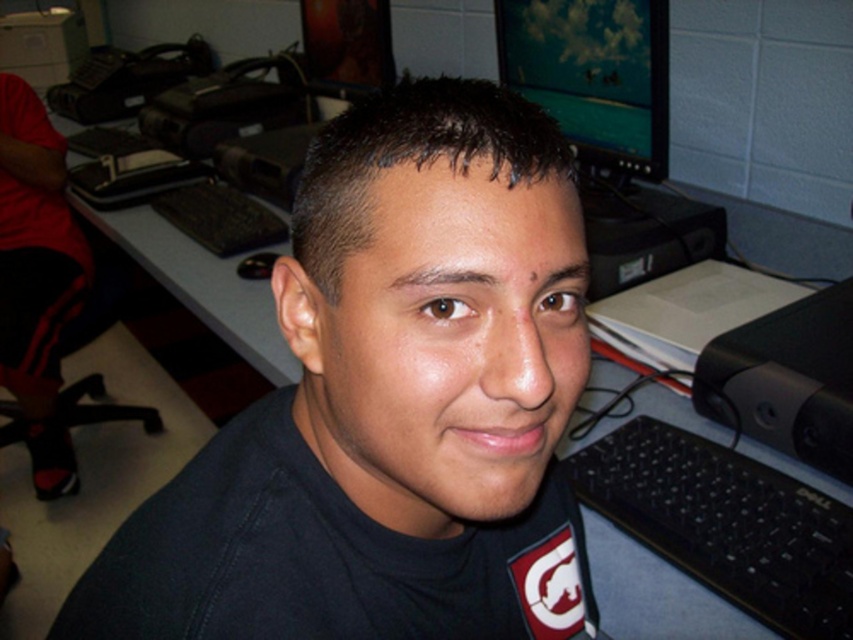
You are a photographer setting up for a portrait shoot. You notice the black plastic keyboard at lower right and the brown matte eyebrow at upper left in the frame. Which object should you adjust to avoid it being too dominant in the photo?

The black plastic keyboard at lower right is bigger than the brown matte eyebrow at upper left, so you should adjust the keyboard to avoid it being too dominant in the photo.

You are a photographer taking a portrait of the person in the image. You want to ensure the black matte shirt at center and the brown hair at upper center are both visible in the frame. Based on their positions, which object should be closer to the left side of the photo?

The black matte shirt at center is to the left of brown hair at upper center, so the black matte shirt at center should be closer to the left side of the photo.

You are a technician trying to locate the black plastic keyboard at lower right on the desk. According to the coordinates provided, where exactly should you look on the desk?

The black plastic keyboard at lower right is located at point coordinates (724, 524) on the desk.